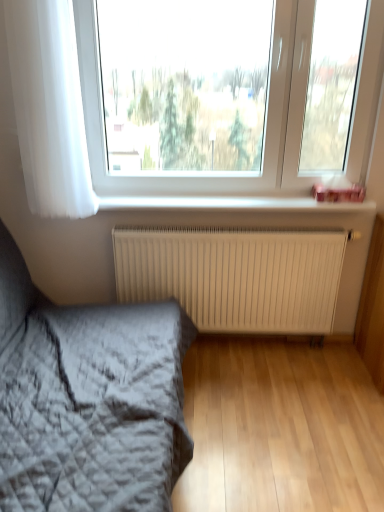
What are the coordinates of `vacant space underneath white matte radiator at center (from a real-world perspective)` in the screenshot? It's located at tap(259, 346).